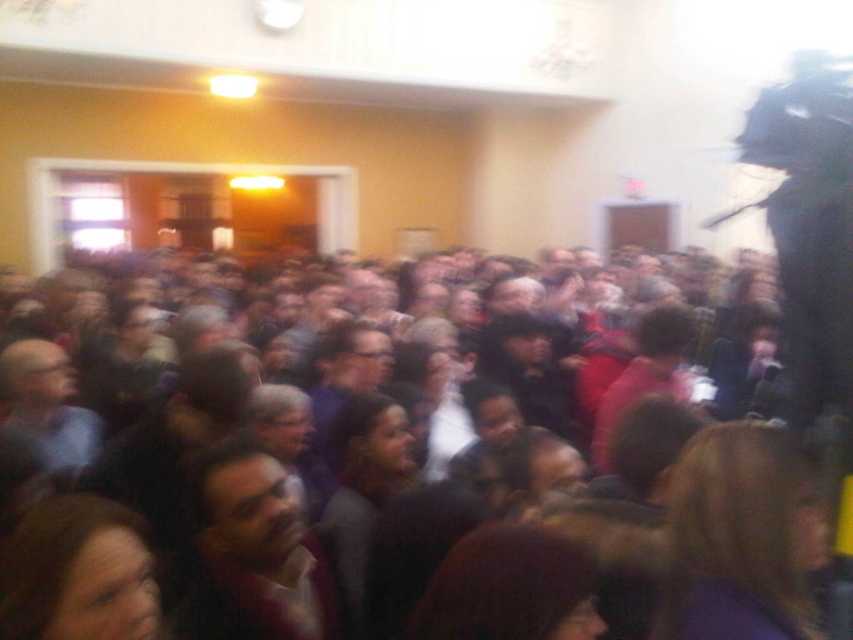
Who is taller, dark brown hair at center or smooth gray shirt at left?

dark brown hair at center is taller.

Can you confirm if dark brown hair at center is positioned above smooth gray shirt at left?

Yes, dark brown hair at center is above smooth gray shirt at left.

Measure the distance between dark brown hair at center and camera.

7.43 feet

Image resolution: width=853 pixels, height=640 pixels. I want to click on dark brown hair at center, so click(210, 349).

Can you confirm if dark brown hair at center is positioned above smooth brown shirt at center?

Yes, dark brown hair at center is above smooth brown shirt at center.

Is dark brown hair at center to the left of smooth brown shirt at center from the viewer's perspective?

Indeed, dark brown hair at center is positioned on the left side of smooth brown shirt at center.

You are a GUI agent. You are given a task and a screenshot of the screen. Output one action in this format:
    pyautogui.click(x=<x>, y=<y>)
    Task: Click on the dark brown hair at center
    Image resolution: width=853 pixels, height=640 pixels.
    Given the screenshot: What is the action you would take?
    pyautogui.click(x=210, y=349)

The width and height of the screenshot is (853, 640). Find the location of `dark brown hair at center`. dark brown hair at center is located at coordinates click(x=210, y=349).

Measure the distance from smooth brown shirt at center to smooth gray shirt at left.

The distance of smooth brown shirt at center from smooth gray shirt at left is 32.55 inches.

Can you confirm if smooth brown shirt at center is positioned to the right of smooth gray shirt at left?

Correct, you'll find smooth brown shirt at center to the right of smooth gray shirt at left.

Who is more forward, [258,604] or [45,445]?

Point [258,604] is more forward.

The image size is (853, 640). In order to click on smooth brown shirt at center in this screenshot , I will do `click(256, 548)`.